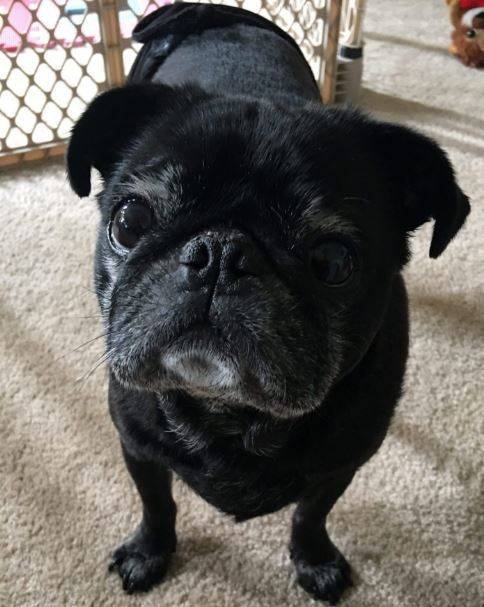
The width and height of the screenshot is (484, 607). I want to click on floor, so click(391, 56).